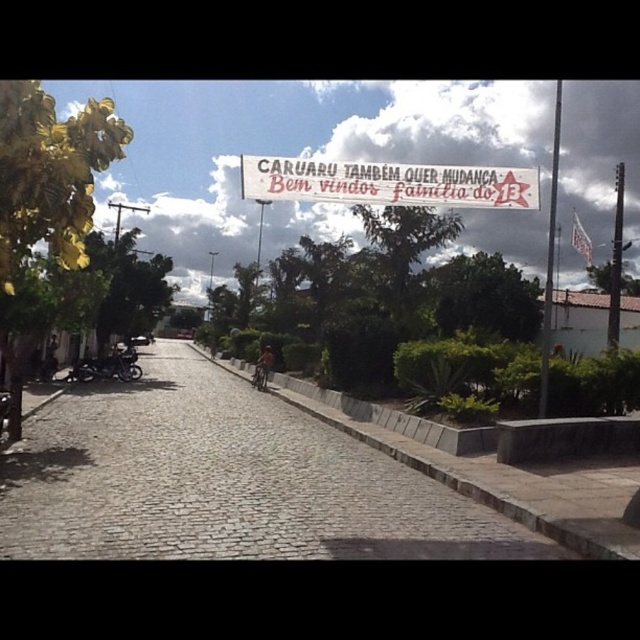
Question: Which point appears closest to the camera in this image?

Choices:
 (A) (429, 164)
 (B) (378, 536)
 (C) (120, 342)

Answer: (B)

Question: Does white paper banner at center have a lesser width compared to shiny black motorcycle at left?

Choices:
 (A) no
 (B) yes

Answer: (A)

Question: Among these points, which one is nearest to the camera?

Choices:
 (A) (225, 449)
 (B) (257, 177)
 (C) (113, 362)

Answer: (B)

Question: Can you confirm if cobblestone pavement at center is positioned to the right of white paper banner at center?

Choices:
 (A) no
 (B) yes

Answer: (A)

Question: Does cobblestone pavement at center appear over white paper banner at center?

Choices:
 (A) yes
 (B) no

Answer: (B)

Question: Which object is the closest to the white paper banner at center?

Choices:
 (A) shiny black motorcycle at left
 (B) cobblestone pavement at center

Answer: (B)